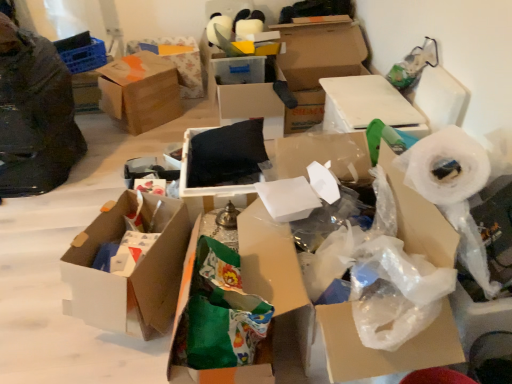
Question: Does cardboard box at upper center, which ranks as the second box in right-to-left order, have a lesser width compared to white plastic roll at right?

Choices:
 (A) no
 (B) yes

Answer: (A)

Question: Is cardboard box at upper center, which ranks as the second box in right-to-left order, outside of white plastic roll at right?

Choices:
 (A) no
 (B) yes

Answer: (B)

Question: Is cardboard box at upper center, arranged as the 7th box when viewed from the left, shorter than white plastic roll at right?

Choices:
 (A) no
 (B) yes

Answer: (A)

Question: Is cardboard box at upper center, which ranks as the second box in right-to-left order, bigger than white plastic roll at right?

Choices:
 (A) no
 (B) yes

Answer: (B)

Question: Would you say cardboard box at upper center, arranged as the 7th box when viewed from the left, contains white plastic roll at right?

Choices:
 (A) no
 (B) yes

Answer: (A)

Question: Visually, is white plastic bag at center, the eighth box in the left-to-right sequence, positioned to the left or to the right of green fabric bag at center, acting as the 5th box starting from the left?

Choices:
 (A) right
 (B) left

Answer: (A)

Question: Considering the positions of white plastic bag at center, the first box in the right-to-left sequence, and green fabric bag at center, acting as the 5th box starting from the left, in the image, is white plastic bag at center, the first box in the right-to-left sequence, taller or shorter than green fabric bag at center, acting as the 5th box starting from the left,?

Choices:
 (A) tall
 (B) short

Answer: (B)

Question: Would you say white plastic bag at center, the eighth box in the left-to-right sequence, is inside or outside green fabric bag at center, acting as the 5th box starting from the left?

Choices:
 (A) inside
 (B) outside

Answer: (B)

Question: From the image's perspective, relative to green fabric bag at center, acting as the 5th box starting from the left, is white plastic bag at center, the first box in the right-to-left sequence, above or below?

Choices:
 (A) above
 (B) below

Answer: (A)

Question: Would you say cardboard box at center is to the left or to the right of white cardboard box at center, which appears as the sixth box when viewed from the left, in the picture?

Choices:
 (A) right
 (B) left

Answer: (A)

Question: From their relative heights in the image, would you say cardboard box at center is taller or shorter than white cardboard box at center, which ranks as the third box in right-to-left order?

Choices:
 (A) short
 (B) tall

Answer: (B)

Question: From the image's perspective, is cardboard box at center above or below white cardboard box at center, which ranks as the third box in right-to-left order?

Choices:
 (A) below
 (B) above

Answer: (A)

Question: In terms of width, does cardboard box at center look wider or thinner when compared to white cardboard box at center, which appears as the sixth box when viewed from the left?

Choices:
 (A) wide
 (B) thin

Answer: (A)

Question: Choose the correct answer: Is white plastic bag at center, the eighth box in the left-to-right sequence, inside brown cardboard box at upper center, which is the 7th box from right to left, or outside it?

Choices:
 (A) inside
 (B) outside

Answer: (B)

Question: From their relative heights in the image, would you say white plastic bag at center, the eighth box in the left-to-right sequence, is taller or shorter than brown cardboard box at upper center, marked as the 2th box in a left-to-right arrangement?

Choices:
 (A) short
 (B) tall

Answer: (B)